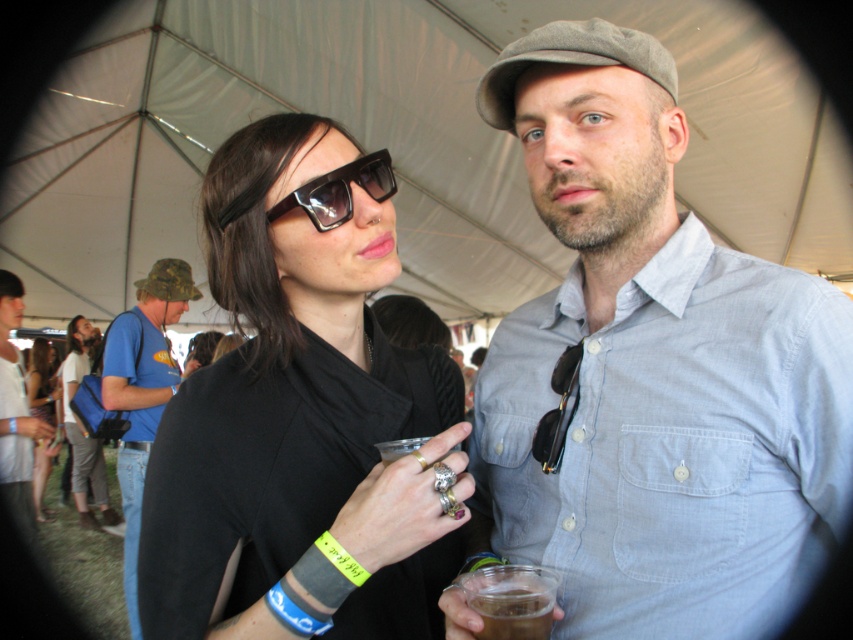
Question: Which is farther from the matte black sunglasses at center?

Choices:
 (A) gray cotton shirt at center
 (B) black plastic sunglasses at upper left

Answer: (A)

Question: Among these points, which one is farthest from the camera?

Choices:
 (A) (27, 465)
 (B) (96, 484)
 (C) (282, 588)
 (D) (172, 291)

Answer: (B)

Question: Can you confirm if matte black shirt at center is positioned above black plastic sunglasses at upper left?

Choices:
 (A) no
 (B) yes

Answer: (A)

Question: Which object appears farthest from the camera in this image?

Choices:
 (A) white cotton t-shirt at center
 (B) matte black dress at lower left
 (C) matte black shirt at center
 (D) gray cotton shirt at center

Answer: (B)

Question: Does gray cotton shirt at center have a smaller size compared to black matte sunglasses at upper center?

Choices:
 (A) yes
 (B) no

Answer: (B)

Question: Does camouflage fabric hat at left appear on the right side of matte black shirt at center?

Choices:
 (A) no
 (B) yes

Answer: (B)